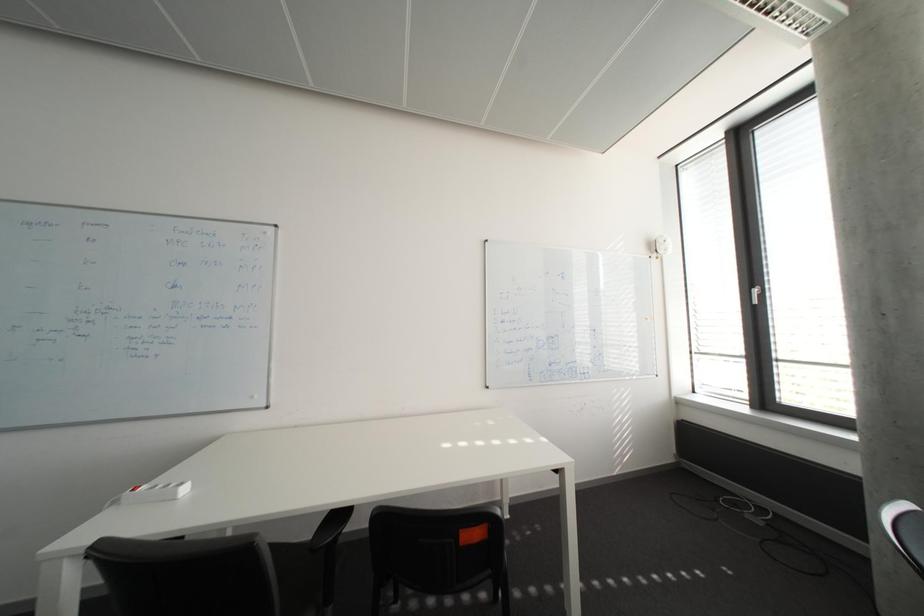
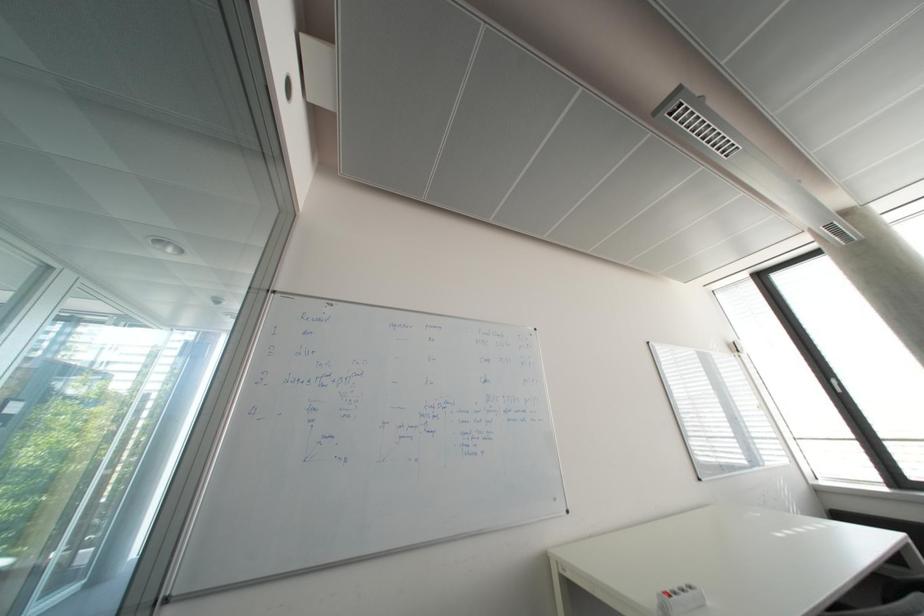
Question: The images are taken continuously from a first-person perspective. In which direction are you moving?

Choices:
 (A) Left
 (B) Right
 (C) Forward
 (D) Backward

Answer: (A)